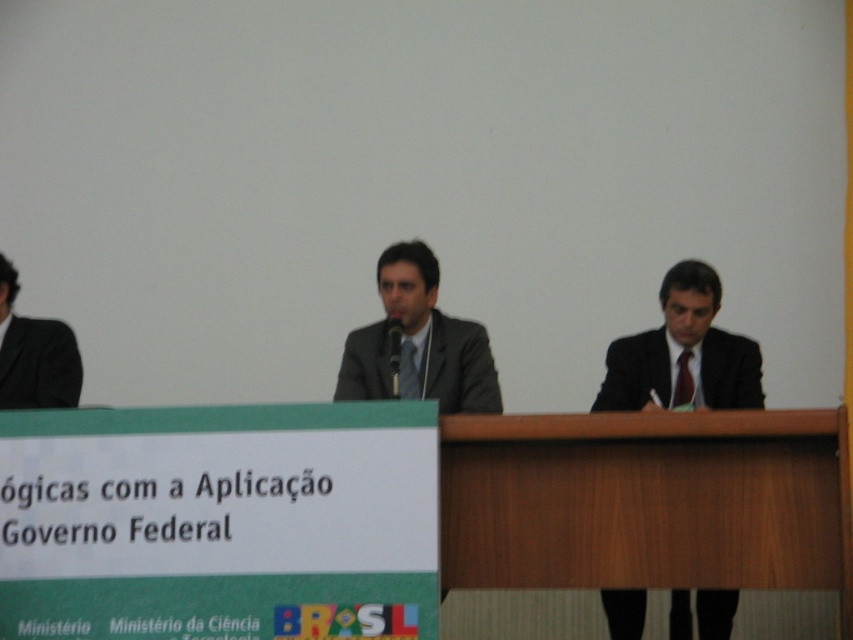
You are standing in front of the table where the three individuals are seated. You notice two points marked on the banner. Which of the two points, point (x=524, y=509) or point (x=32, y=394), is closer to you?

Point (x=524, y=509) is closer to the viewer than point (x=32, y=394).